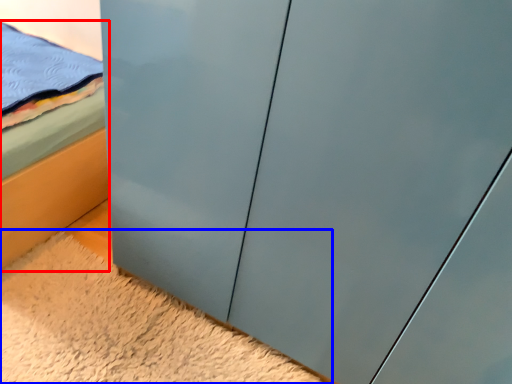
Question: Which of the following is the closest to the observer, bed (highlighted by a red box) or plain (highlighted by a blue box)?

Choices:
 (A) bed
 (B) plain

Answer: (B)